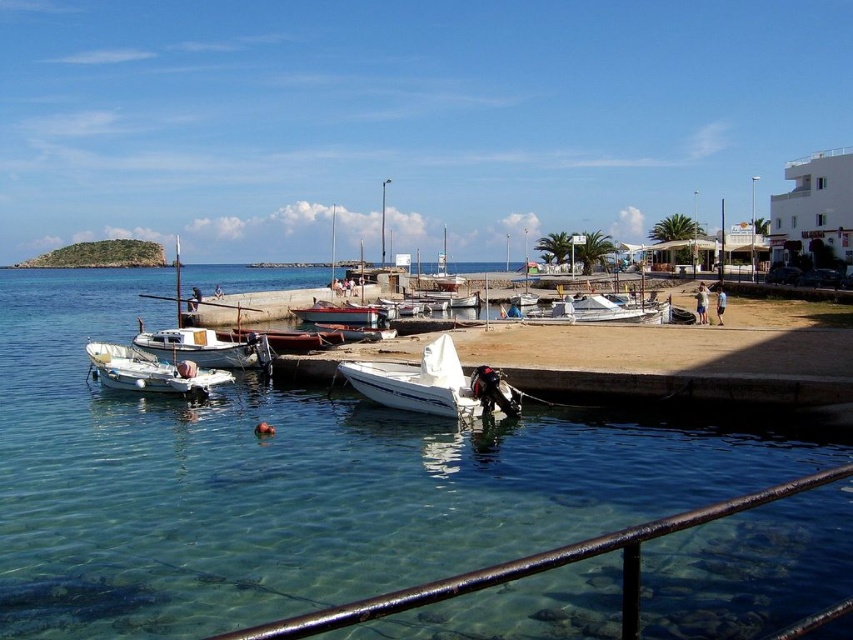
Question: Which point is closer to the camera taking this photo?

Choices:
 (A) (321, 301)
 (B) (477, 464)
 (C) (230, 637)
 (D) (415, 385)

Answer: (C)

Question: Among these objects, which one is farthest from the camera?

Choices:
 (A) rusty metal railing at lower center
 (B) metallic silver boat at center
 (C) clear water at lower left

Answer: (B)

Question: Does white matte motorboat at center appear under wooden boat at center?

Choices:
 (A) no
 (B) yes

Answer: (B)

Question: Considering the relative positions of rusty metal railing at lower center and white matte motorboat at center in the image provided, where is rusty metal railing at lower center located with respect to white matte motorboat at center?

Choices:
 (A) left
 (B) right

Answer: (B)

Question: Among these objects, which one is nearest to the camera?

Choices:
 (A) rusty metal railing at lower center
 (B) white matte motorboat at center
 (C) wooden boat at center

Answer: (A)

Question: Is clear water at lower left bigger than white matte boat at lower left?

Choices:
 (A) yes
 (B) no

Answer: (A)